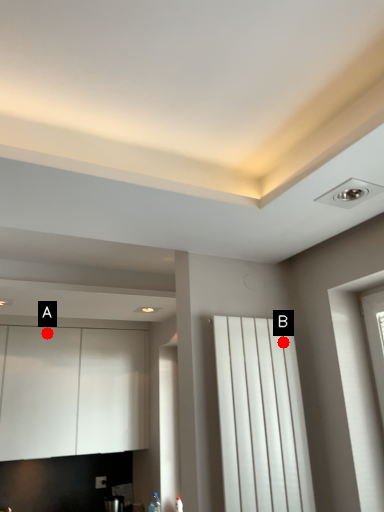
Question: Two points are circled on the image, labeled by A and B beside each circle. Which point is farther to the camera?

Choices:
 (A) A is further
 (B) B is further

Answer: (A)